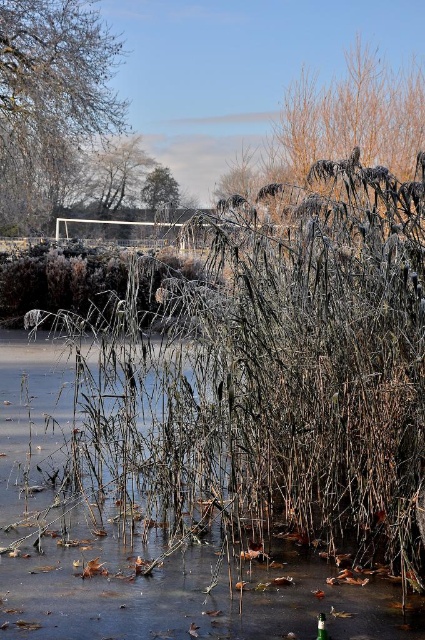
Can you confirm if brown matte bush at center is positioned to the right of green leafy tree at upper center?

Incorrect, brown matte bush at center is not on the right side of green leafy tree at upper center.

Is point (132, 282) closer to camera compared to point (146, 180)?

That is True.

The image size is (425, 640). Identify the location of brown matte bush at center. (96, 284).

At what (x,y) coordinates should I click in order to perform the action: click on brown matte bush at center. Please return your answer as a coordinate pair (x, y). Image resolution: width=425 pixels, height=640 pixels. Looking at the image, I should click on (96, 284).

Measure the distance from smooth white tree at upper left to brown matte bush at center.

smooth white tree at upper left and brown matte bush at center are 3.09 meters apart.

Does smooth white tree at upper left have a larger size compared to brown matte bush at center?

No, smooth white tree at upper left is not bigger than brown matte bush at center.

Locate an element on the screen. smooth white tree at upper left is located at coordinates (50, 100).

Is brown textured tree at upper center to the right of green leafy tree at upper center from the viewer's perspective?

In fact, brown textured tree at upper center is to the left of green leafy tree at upper center.

This screenshot has height=640, width=425. I want to click on brown textured tree at upper center, so click(x=116, y=172).